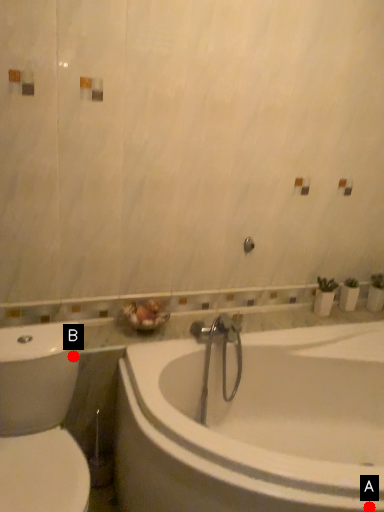
Question: Two points are circled on the image, labeled by A and B beside each circle. Which point is closer to the camera?

Choices:
 (A) A is closer
 (B) B is closer

Answer: (A)